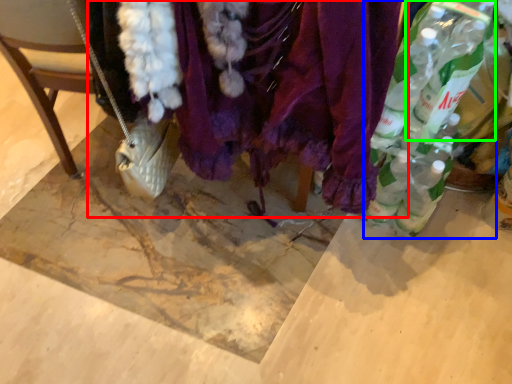
Question: Based on their relative distances, which object is farther from textile (highlighted by a red box)? Choose from bottle (highlighted by a blue box) and bottle (highlighted by a green box).

Choices:
 (A) bottle
 (B) bottle

Answer: (B)